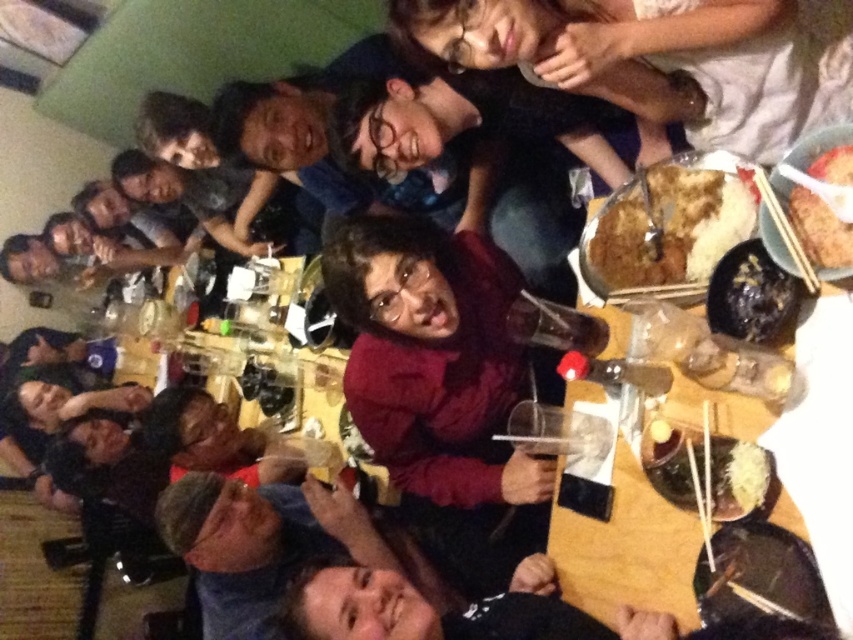
Is wooden table at center bigger than brown crispy rice at center?

Yes.

Can you confirm if wooden table at center is thinner than brown crispy rice at center?

Incorrect, wooden table at center's width is not less than brown crispy rice at center's.

Between point (747, 428) and point (677, 220), which one is positioned behind?

Positioned behind is point (677, 220).

What are the coordinates of `wooden table at center` in the screenshot? It's located at (799, 436).

Can you confirm if dark red sweater at center is smaller than brown rice at upper right?

No.

Can you confirm if dark red sweater at center is wider than brown rice at upper right?

Indeed, dark red sweater at center has a greater width compared to brown rice at upper right.

Where is `dark red sweater at center`? The image size is (853, 640). dark red sweater at center is located at coordinates (433, 356).

At what (x,y) coordinates should I click in order to perform the action: click on dark red sweater at center. Please return your answer as a coordinate pair (x, y). Image resolution: width=853 pixels, height=640 pixels. Looking at the image, I should click on [x=433, y=356].

Does dark red sweater at center have a larger size compared to black glossy bowl at lower right?

Yes, dark red sweater at center is bigger than black glossy bowl at lower right.

Between dark red sweater at center and black glossy bowl at lower right, which one appears on the right side from the viewer's perspective?

black glossy bowl at lower right

This screenshot has height=640, width=853. What do you see at coordinates (433, 356) in the screenshot?
I see `dark red sweater at center` at bounding box center [433, 356].

Find the location of a particular element. This screenshot has height=640, width=853. dark red sweater at center is located at coordinates (x=433, y=356).